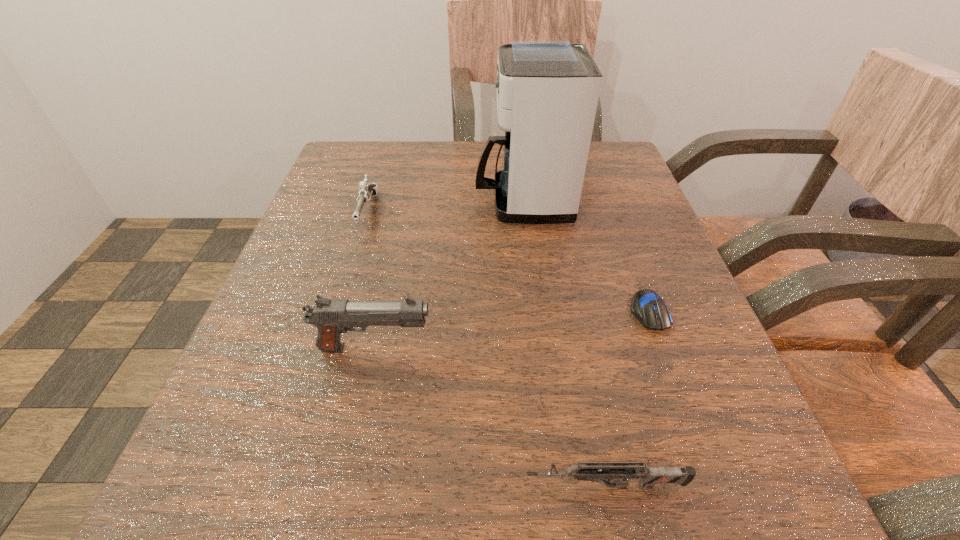
Where is `free spot located on the front panel of the tallest object`? Image resolution: width=960 pixels, height=540 pixels. free spot located on the front panel of the tallest object is located at coordinates (361, 201).

Find the location of a particular element. This screenshot has height=540, width=960. free space located 0.290m on the front panel of the tallest object is located at coordinates (331, 201).

At what (x,y) coordinates should I click in order to perform the action: click on vacant space positioned 0.270m in the direction the second farthest gun is aimed. Please return your answer as a coordinate pair (x, y). This screenshot has width=960, height=540. Looking at the image, I should click on (623, 348).

Where is `vacant space located 0.280m aimed along the barrel of the farthest gun`? Image resolution: width=960 pixels, height=540 pixels. vacant space located 0.280m aimed along the barrel of the farthest gun is located at coordinates (320, 366).

Find the location of `free space located aimed along the barrel of the shortest gun`. free space located aimed along the barrel of the shortest gun is located at coordinates (200, 486).

Locate an element on the screen. This screenshot has width=960, height=540. vacant region located 0.050m aimed along the barrel of the shortest gun is located at coordinates (481, 486).

At what (x,y) coordinates should I click in order to perform the action: click on vacant space situated aimed along the barrel of the shortest gun. Please return your answer as a coordinate pair (x, y). The width and height of the screenshot is (960, 540). Looking at the image, I should click on (318, 486).

Locate an element on the screen. vacant position located on the button side of the shortest object is located at coordinates (715, 491).

Where is `coffee maker that is at the far edge`? The height and width of the screenshot is (540, 960). coffee maker that is at the far edge is located at coordinates (547, 90).

What are the coordinates of `gun positioned at the far edge` in the screenshot? It's located at (366, 190).